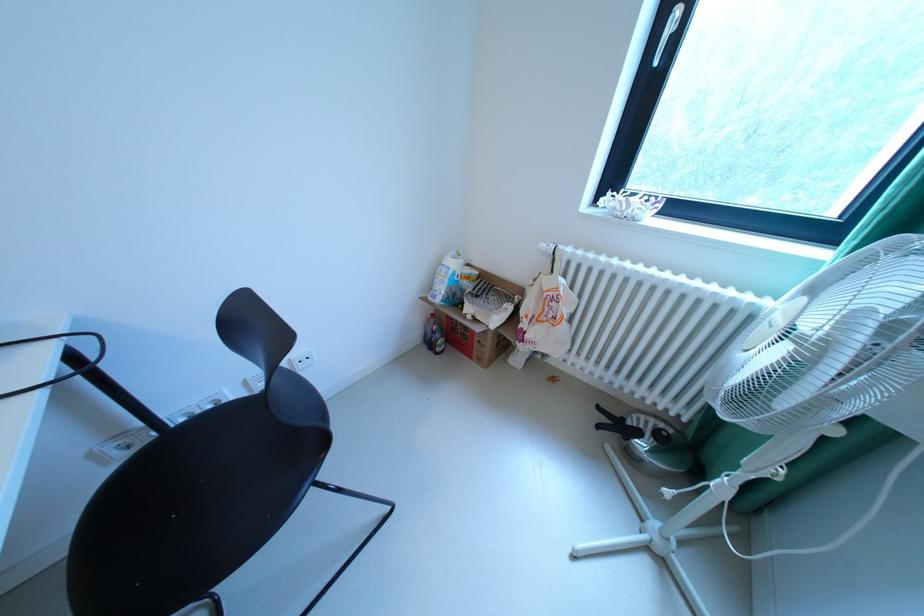
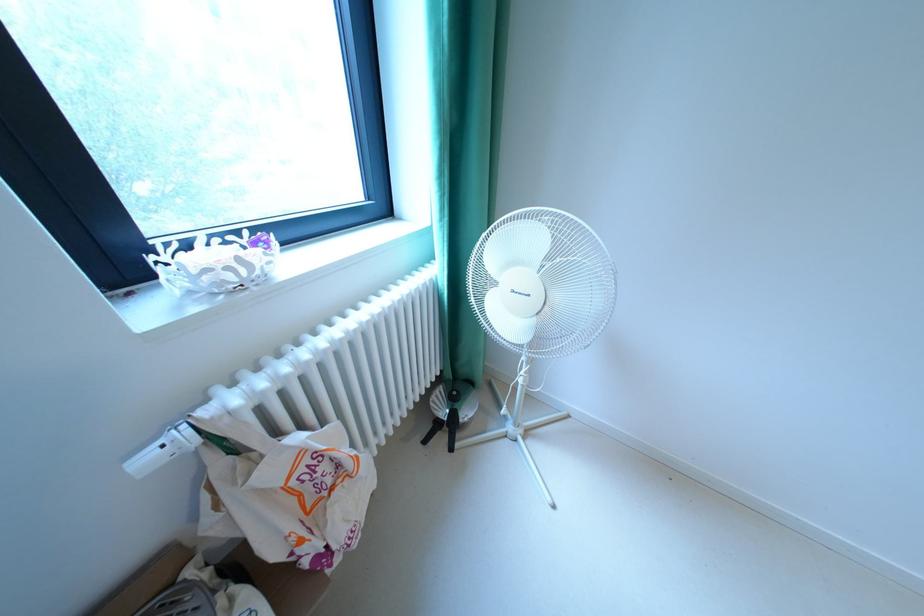
In the second image, find the point that corresponds to point 553,246 in the first image.

(156, 460)